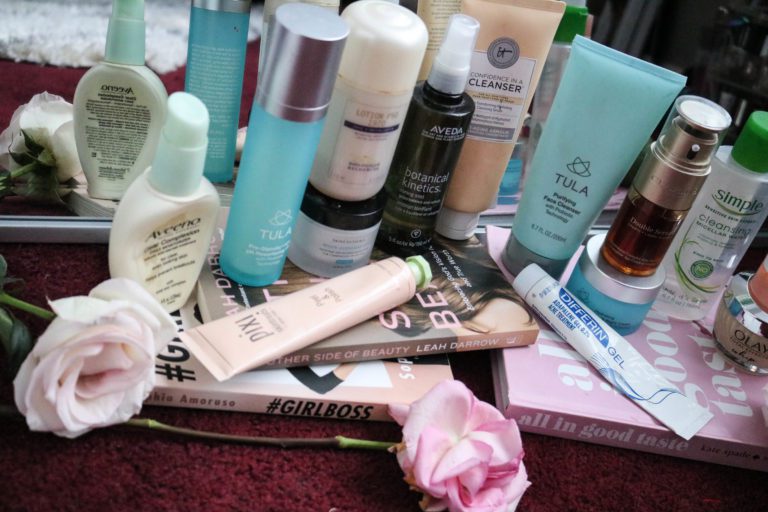
Where is `mirror`? This screenshot has width=768, height=512. mirror is located at coordinates (61, 70).